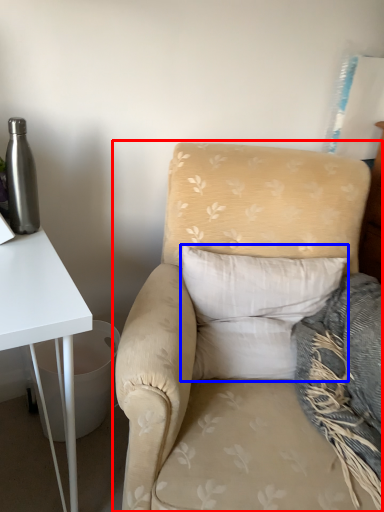
Question: Which object is further to the camera taking this photo, chair (highlighted by a red box) or pillow (highlighted by a blue box)?

Choices:
 (A) chair
 (B) pillow

Answer: (B)